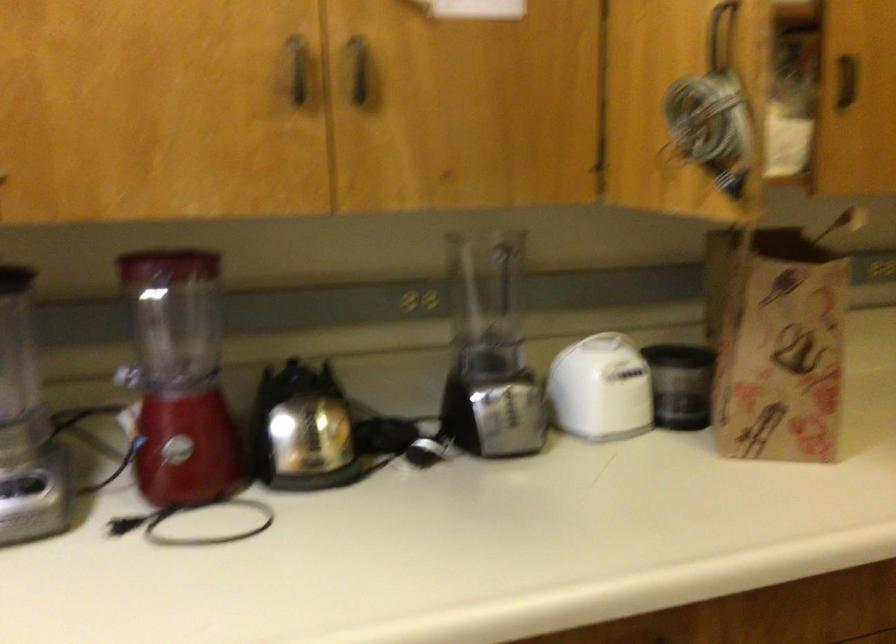
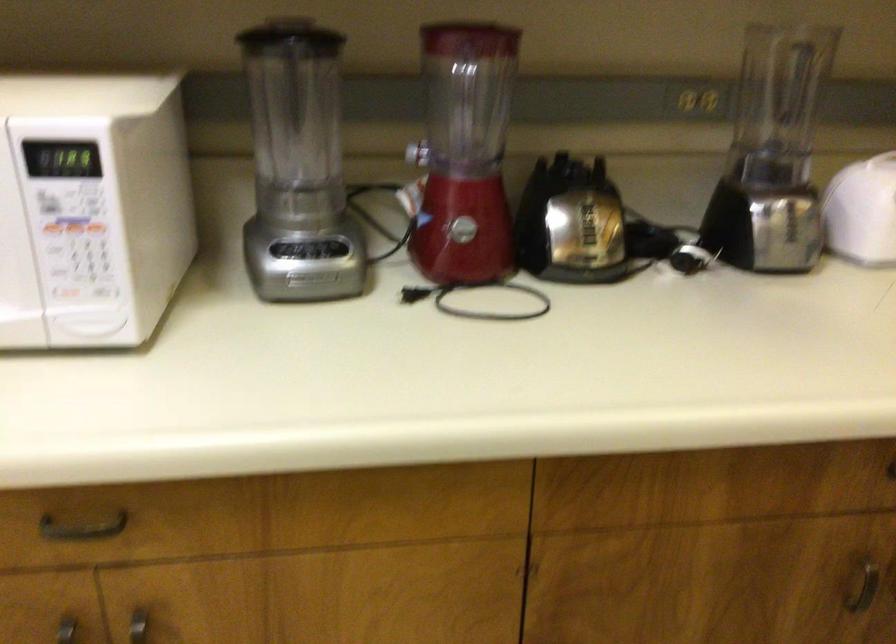
In the second image, find the point that corresponds to pixel 496 299 in the first image.

(779, 100)